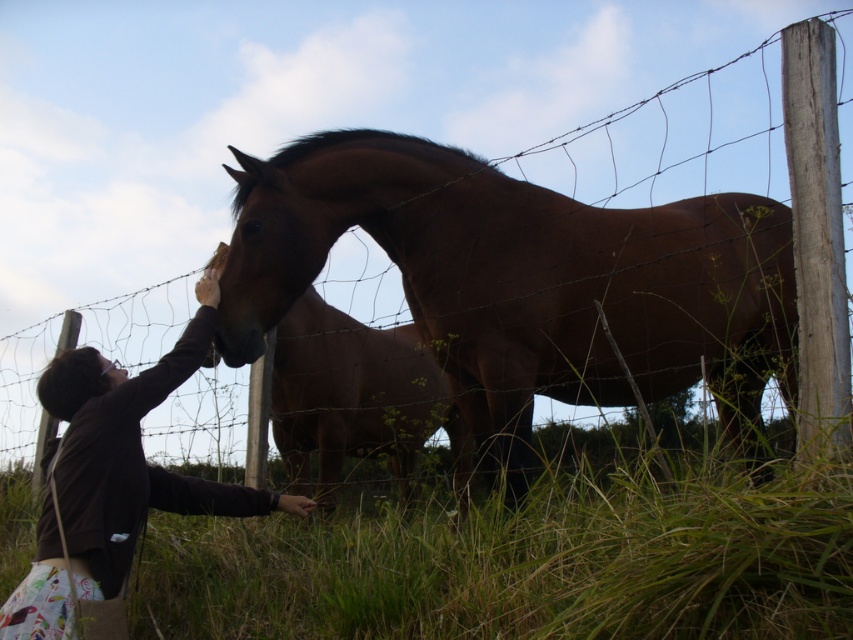
Question: Considering the relative positions of brown glossy horse at center and dark brown sweater at left in the image provided, where is brown glossy horse at center located with respect to dark brown sweater at left?

Choices:
 (A) left
 (B) right

Answer: (B)

Question: Based on their relative distances, which object is nearer to the brown glossy horse at center?

Choices:
 (A) dark brown sweater at left
 (B) green grass at lower center

Answer: (B)

Question: Which point is closer to the camera taking this photo?

Choices:
 (A) (822, 602)
 (B) (119, 548)
 (C) (271, 166)

Answer: (A)

Question: Considering the relative positions of green grass at lower center and dark brown sweater at left in the image provided, where is green grass at lower center located with respect to dark brown sweater at left?

Choices:
 (A) right
 (B) left

Answer: (A)

Question: Which object appears closest to the camera in this image?

Choices:
 (A) green grass at lower center
 (B) dark brown sweater at left
 (C) brown glossy horse at center

Answer: (A)

Question: Observing the image, what is the correct spatial positioning of brown glossy horse at center in reference to green grass at lower center?

Choices:
 (A) below
 (B) above

Answer: (B)